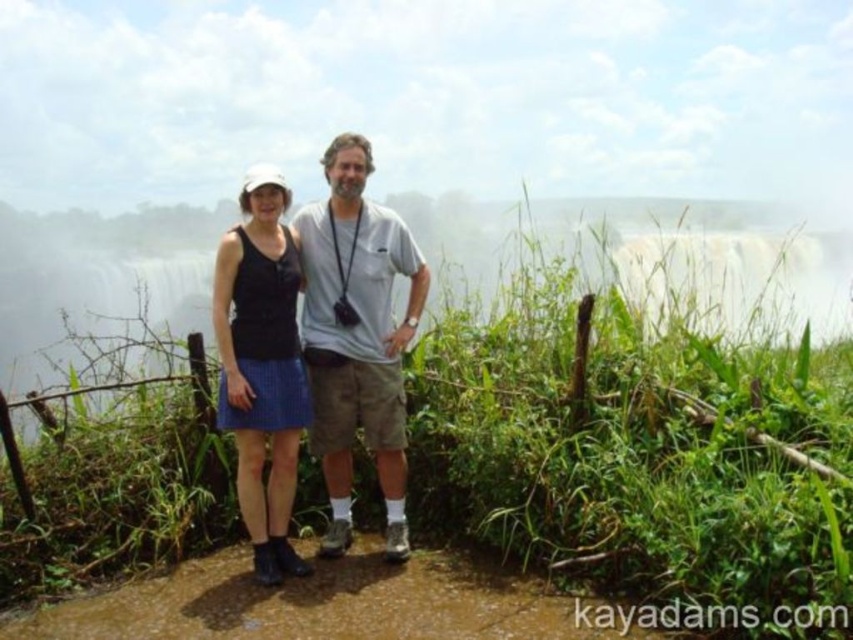
Question: Does green leafy shrubs at center lie in front of matte black tank top at center?

Choices:
 (A) yes
 (B) no

Answer: (A)

Question: Which point is closer to the camera taking this photo?

Choices:
 (A) (341, 477)
 (B) (247, 381)

Answer: (B)

Question: Which of the following is the closest to the observer?

Choices:
 (A) matte black tank top at center
 (B) green leafy shrubs at center

Answer: (B)

Question: Which object is the closest to the green leafy shrubs at center?

Choices:
 (A) matte black tank top at center
 (B) gray cotton t-shirt at center

Answer: (B)

Question: Is green leafy shrubs at center in front of gray cotton t-shirt at center?

Choices:
 (A) no
 (B) yes

Answer: (B)

Question: Can you confirm if gray cotton t-shirt at center is bigger than matte black tank top at center?

Choices:
 (A) no
 (B) yes

Answer: (B)